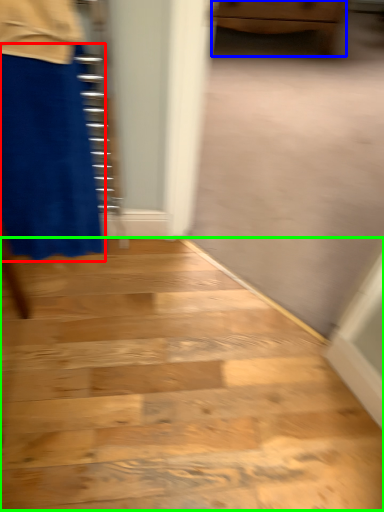
Question: Estimate the real-world distances between objects in this image. Which object is farther from miniskirt (highlighted by a red box), furniture (highlighted by a blue box) or stairwell (highlighted by a green box)?

Choices:
 (A) furniture
 (B) stairwell

Answer: (A)